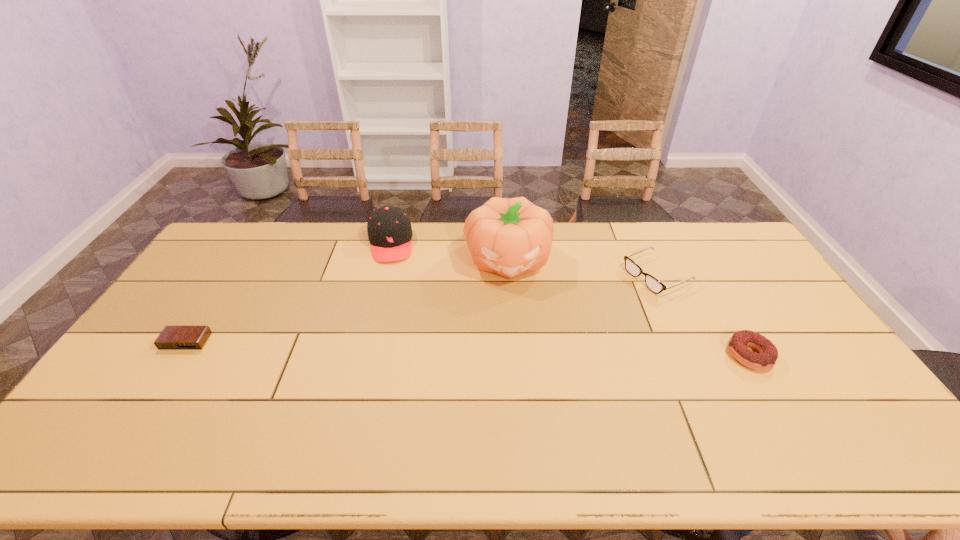
Image resolution: width=960 pixels, height=540 pixels. Identify the location of vacant position located on the carved face of the tallest object. (517, 359).

You are a GUI agent. You are given a task and a screenshot of the screen. Output one action in this format:
    pyautogui.click(x=<x>, y=<y>)
    Task: Click on the free space located on the carved face of the tallest object
    The width and height of the screenshot is (960, 540).
    Given the screenshot: What is the action you would take?
    pyautogui.click(x=517, y=356)

At what (x,y) coordinates should I click in order to perform the action: click on free space located on the carved face of the tallest object. Please return your answer as a coordinate pair (x, y). Image resolution: width=960 pixels, height=540 pixels. Looking at the image, I should click on (514, 318).

You are a GUI agent. You are given a task and a screenshot of the screen. Output one action in this format:
    pyautogui.click(x=<x>, y=<y>)
    Task: Click on the free space located 0.140m on the front-facing side of the spectacles
    The height and width of the screenshot is (540, 960).
    Given the screenshot: What is the action you would take?
    pyautogui.click(x=600, y=301)

At what (x,y) coordinates should I click in order to perform the action: click on free space located 0.110m on the front-facing side of the spectacles. Please return your answer as a coordinate pair (x, y). Image resolution: width=960 pixels, height=540 pixels. Looking at the image, I should click on (608, 298).

Identify the location of vacant region located on the front-facing side of the spectacles. (605, 299).

Image resolution: width=960 pixels, height=540 pixels. In order to click on vacant point located on the front-facing side of the fourth shortest object in this screenshot , I will do `click(395, 343)`.

Identify the location of vacant space located 0.050m on the front-facing side of the fourth shortest object. (390, 273).

The height and width of the screenshot is (540, 960). What are the coordinates of `vacant space situated 0.090m on the front-facing side of the fourth shortest object` in the screenshot? It's located at (391, 280).

This screenshot has height=540, width=960. What are the coordinates of `pumpkin present at the far edge` in the screenshot? It's located at (509, 237).